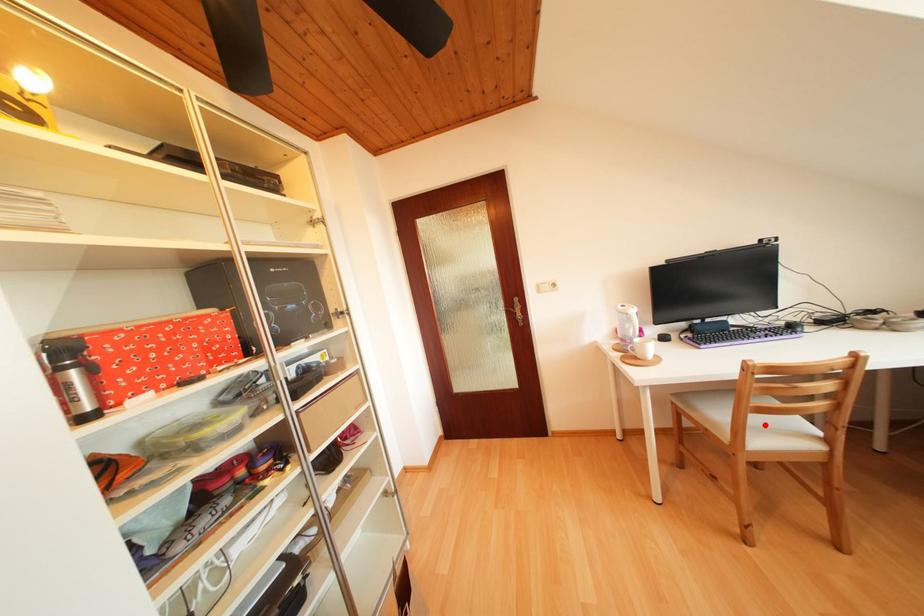
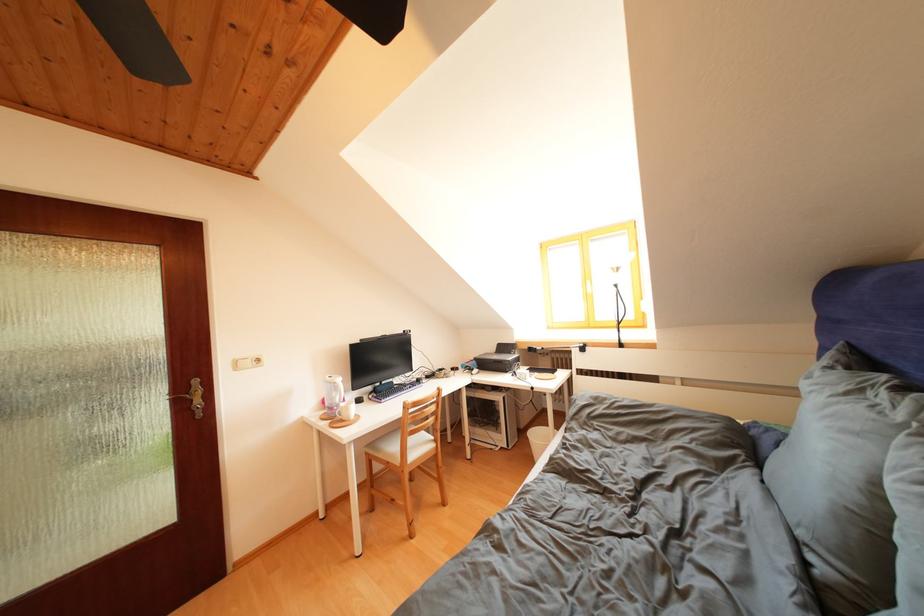
Where in the second image is the point corresponding to the highlighted location from the first image?

(419, 446)